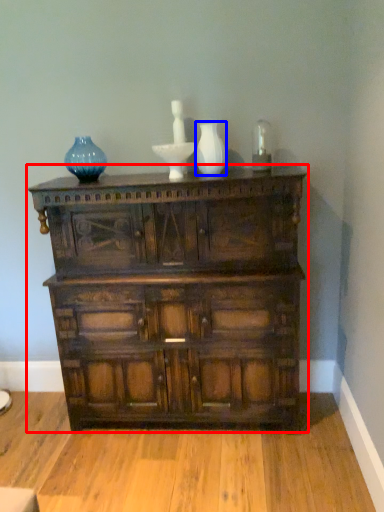
Question: Which point is further to the camera, chest of drawers (highlighted by a red box) or glass vase (highlighted by a blue box)?

Choices:
 (A) chest of drawers
 (B) glass vase

Answer: (B)